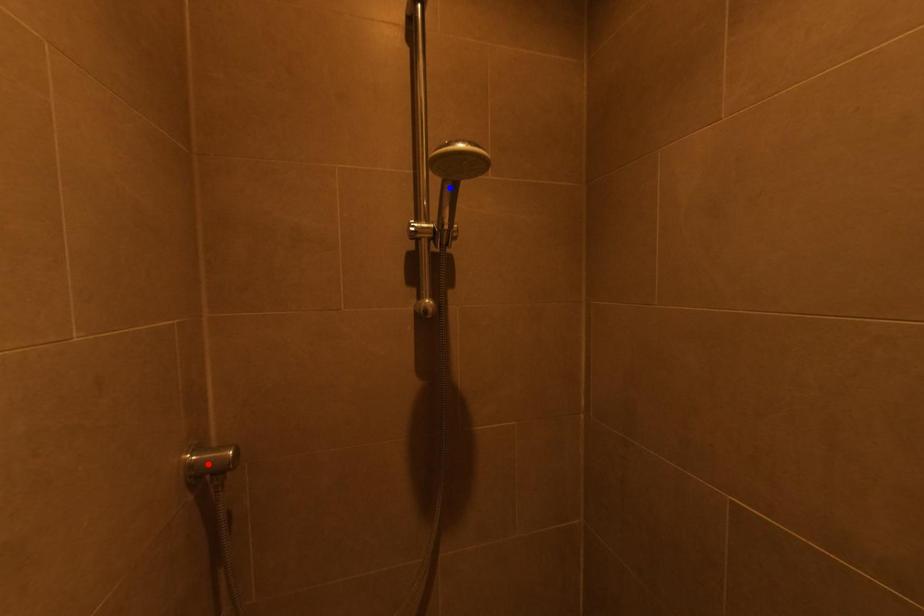
Question: In the image, two points are highlighted. Which point is nearer to the camera? Reply with the corresponding letter.

Choices:
 (A) blue point
 (B) red point

Answer: (B)